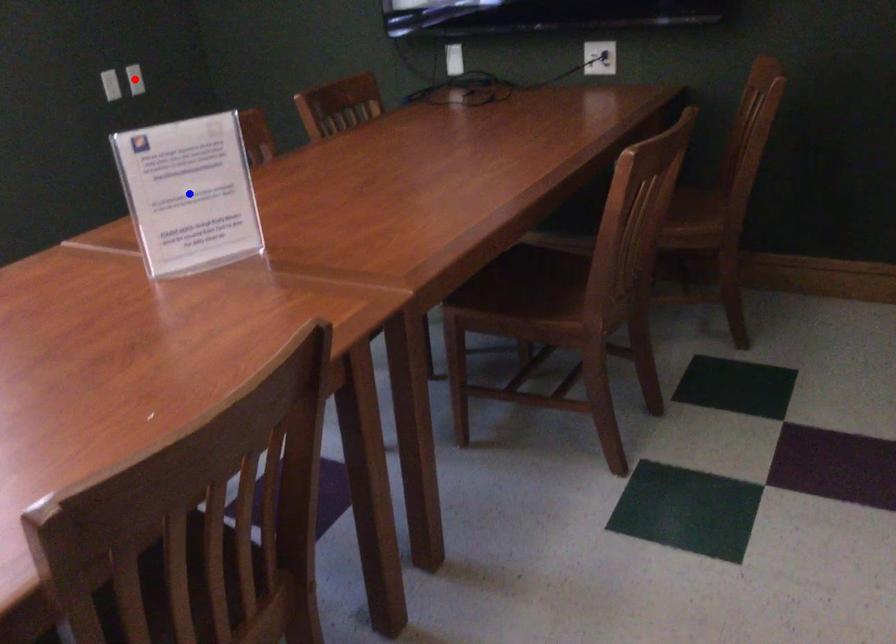
Question: In the image, two points are highlighted. Which point is nearer to the camera? Reply with the corresponding letter.

Choices:
 (A) blue point
 (B) red point

Answer: (A)